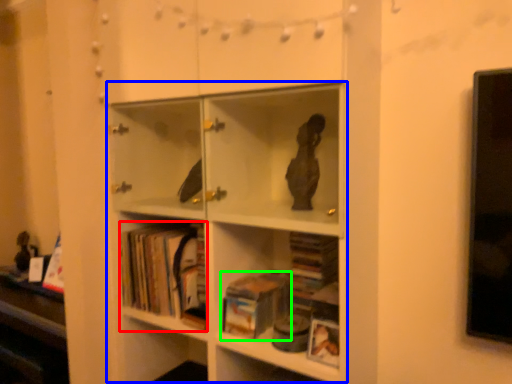
Question: Which object is positioned closest to book (highlighted by a red box)? Select from bookcase (highlighted by a blue box) and book (highlighted by a green box).

Choices:
 (A) bookcase
 (B) book

Answer: (A)